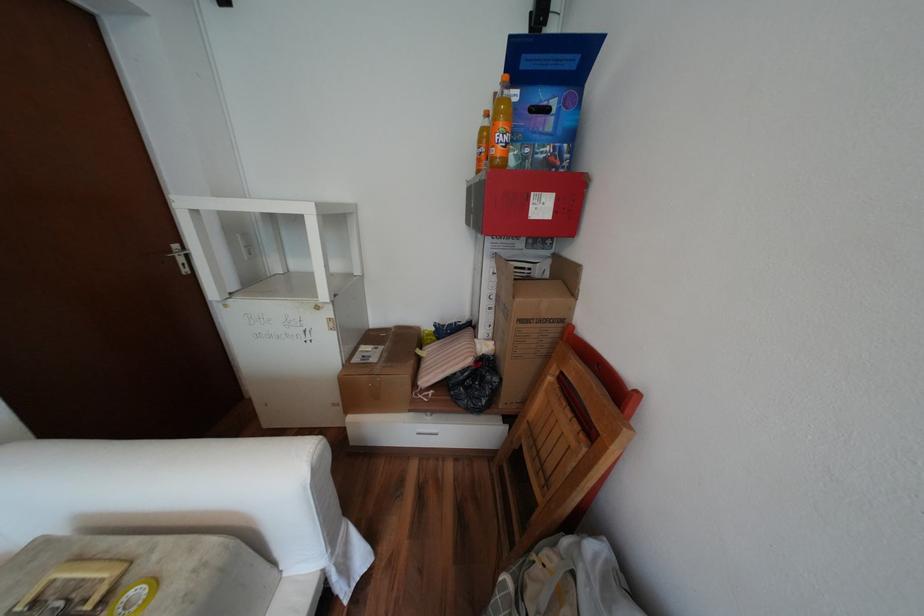
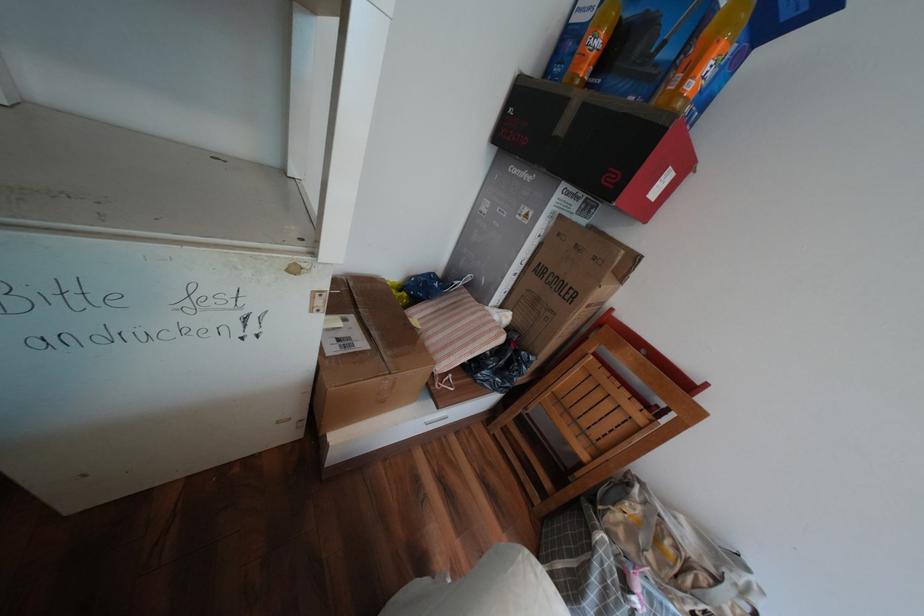
Based on the continuous images, in which direction is the camera rotating?

The rotation direction of the camera is right-down.